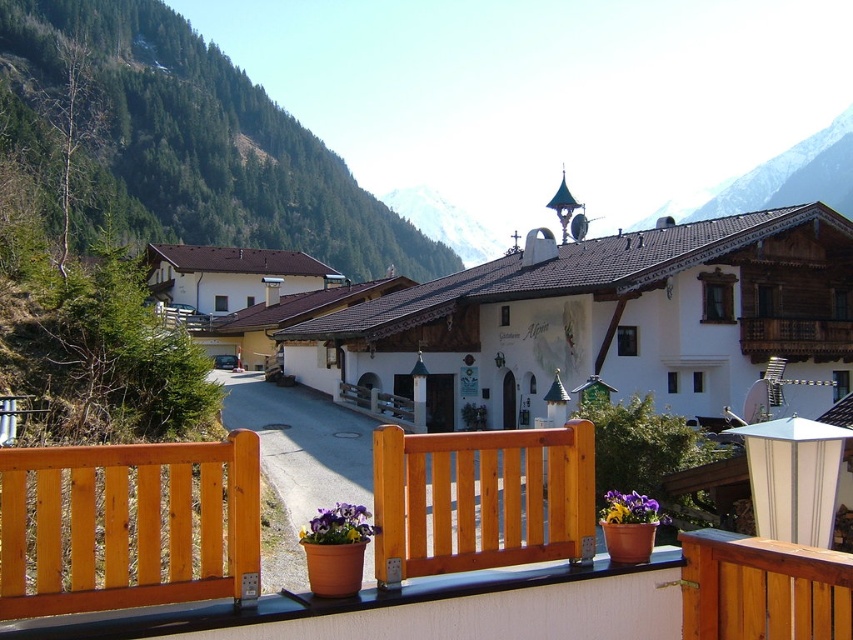
From the picture: You are a painter who wants to paint the light brown wooden balustrade at center and the purple matte flower pot at lower center. Which object requires more paint because it has a larger surface area?

The purple matte flower pot at lower center requires more paint because it is larger than the light brown wooden balustrade at center.

You are a painter setting up your easel in the alpine village scene. You want to paint the purple matte flower at lower center without including the light brown wooden bench at lower left in your composition. Is the bench blocking your view of the flower?

The light brown wooden bench at lower left is positioned over the purple matte flower at lower center, so the bench is blocking the view of the flower. To paint the flower without the bench, you would need to move the bench or adjust your position to see around it.

You are a painter who wants to paint the light brown wooden balustrade at center and the purple matte flower pot at lower center. If you have enough paint for an object with a width of 1.2 meters, which object should you choose to paint?

The light brown wooden balustrade at center has a smaller width than the purple matte flower pot at lower center, so you should choose the light brown wooden balustrade at center to paint since it requires less paint.